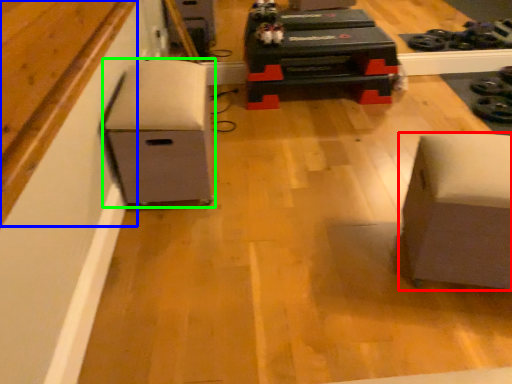
Question: Which is nearer to the furniture (highlighted by a red box)? wood (highlighted by a blue box) or furniture (highlighted by a green box).

Choices:
 (A) wood
 (B) furniture

Answer: (B)